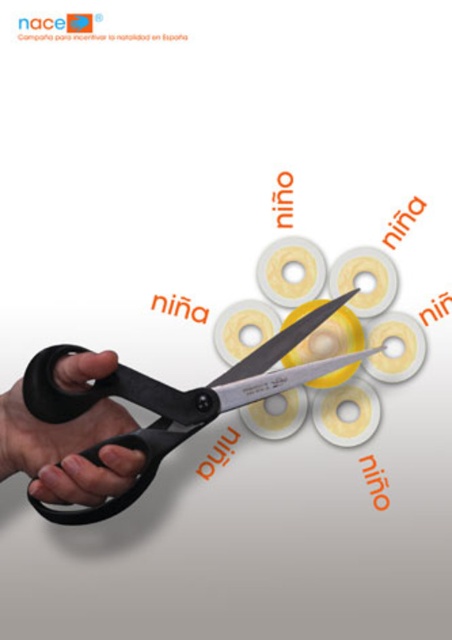
Can you confirm if black plastic scissors at center is taller than black rubber hand at lower left?

Indeed, black plastic scissors at center has a greater height compared to black rubber hand at lower left.

Which is behind, point (147, 468) or point (104, 360)?

Point (147, 468)

Find the location of a particular element. This screenshot has width=452, height=640. black plastic scissors at center is located at coordinates (170, 403).